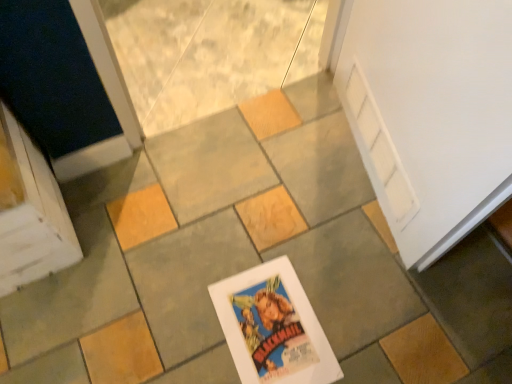
The width and height of the screenshot is (512, 384). I want to click on vacant space behind white paper picture frame at center, so click(x=273, y=234).